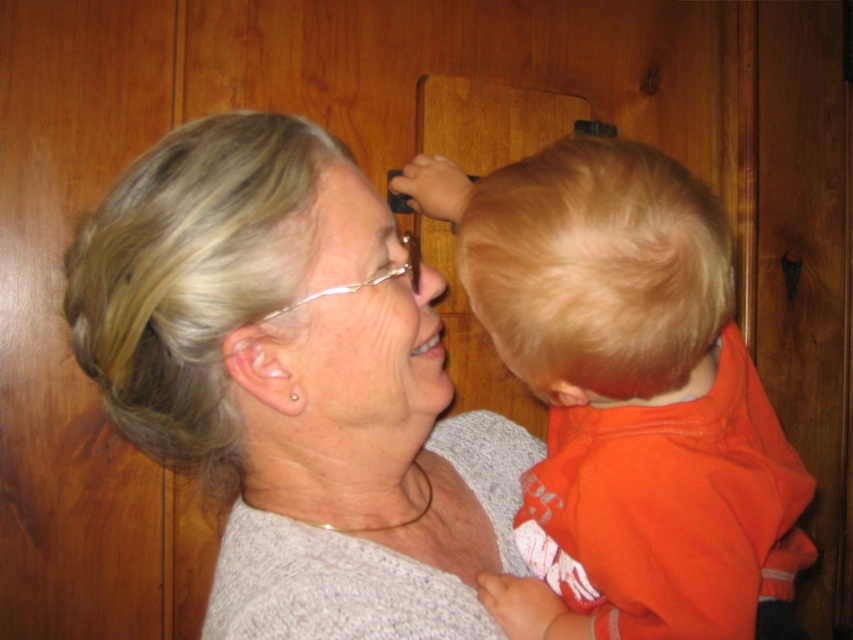
Does gray knit sweater at upper left have a smaller size compared to matte skin forehead at upper center?

No, gray knit sweater at upper left is not smaller than matte skin forehead at upper center.

Between gray knit sweater at upper left and matte skin forehead at upper center, which one is positioned lower?

Positioned lower is gray knit sweater at upper left.

Is point (231, 310) positioned before point (347, 362)?

Yes, it is.

At what (x,y) coordinates should I click in order to perform the action: click on gray knit sweater at upper left. Please return your answer as a coordinate pair (x, y). Looking at the image, I should click on (292, 396).

Is gray knit sweater at upper left positioned behind orange cotton shirt at right?

Yes, gray knit sweater at upper left is behind orange cotton shirt at right.

Does gray knit sweater at upper left have a larger size compared to orange cotton shirt at right?

Yes, gray knit sweater at upper left is bigger than orange cotton shirt at right.

Locate an element on the screen. gray knit sweater at upper left is located at coordinates (292, 396).

Does orange cotton shirt at right have a smaller size compared to matte skin forehead at upper center?

No, orange cotton shirt at right is not smaller than matte skin forehead at upper center.

Does point (494, 305) come closer to viewer compared to point (322, 218)?

That is True.

Image resolution: width=853 pixels, height=640 pixels. Identify the location of orange cotton shirt at right. (627, 397).